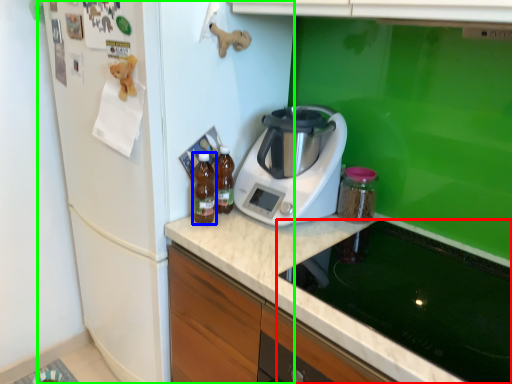
Question: Considering the real-world distances, which object is closest to home appliance (highlighted by a red box)? kitchen appliance (highlighted by a blue box) or fridge (highlighted by a green box).

Choices:
 (A) kitchen appliance
 (B) fridge

Answer: (A)